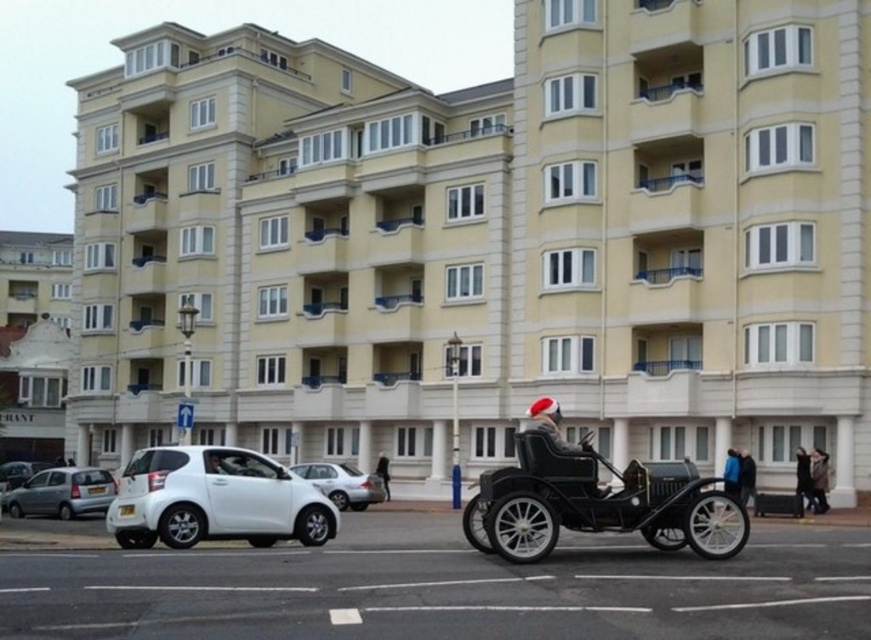
You are standing at the point marked as point (x=593, y=504). What object is located at that point?

The shiny black car at lower right is located at point (x=593, y=504).

You are a delivery driver in a truck that is 2 meters wide. You need to drive through the street where the beige concrete building at center and the white matte car at center are located. Can your truck pass through the narrowest part of the street between these two objects?

The beige concrete building at center might be wider than the white matte car at center, but without exact measurements, it is uncertain whether the truck can pass. Check the actual width of the street before proceeding.

Based on the photo, you are a delivery person who needs to park your delivery van next to the white matte car at center and the santa hat leather jacket at center. Which object should you park closer to if you want to ensure your van doesn not block the entrance to the building?

You should park closer to the white matte car at center because it is wider than the santa hat leather jacket at center, so there will be more space available near it to avoid blocking the entrance.